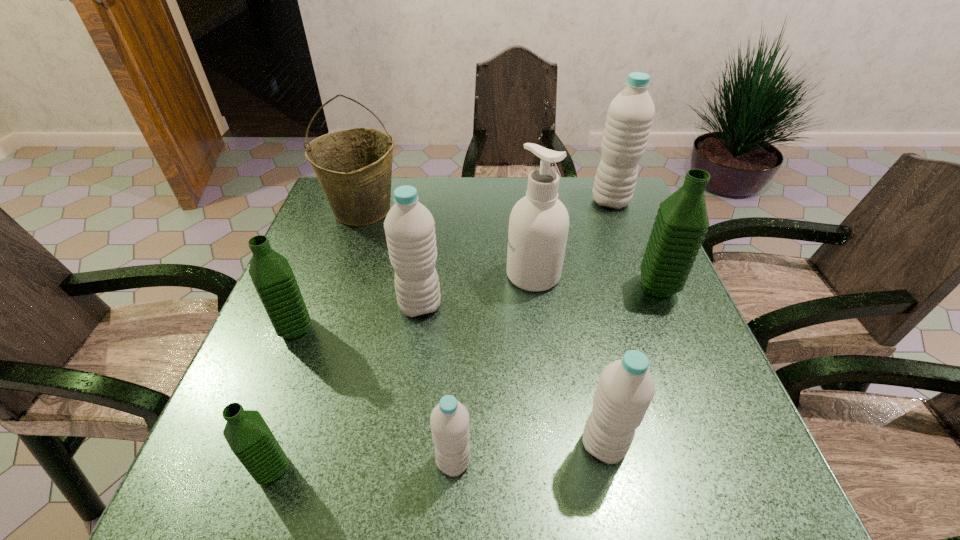
I want to click on object that is at the far right corner, so click(630, 114).

In the image, there is a desktop. Identify the location of vacant space at the far edge. The height and width of the screenshot is (540, 960). (433, 179).

This screenshot has width=960, height=540. I want to click on free space at the left edge, so click(316, 389).

I want to click on free location at the right edge of the desktop, so click(x=625, y=286).

Locate an element on the screen. The height and width of the screenshot is (540, 960). free space at the far left corner of the desktop is located at coordinates (321, 217).

Where is `vacant area at the far right corner of the desktop`? This screenshot has height=540, width=960. vacant area at the far right corner of the desktop is located at coordinates (640, 216).

Where is `unoccupied area between the nearest green water bottle and the biggest green water bottle`? The width and height of the screenshot is (960, 540). unoccupied area between the nearest green water bottle and the biggest green water bottle is located at coordinates (465, 378).

Find the location of `vacant space that's between the nearest green water bottle and the second farthest green water bottle`. vacant space that's between the nearest green water bottle and the second farthest green water bottle is located at coordinates (283, 399).

You are a GUI agent. You are given a task and a screenshot of the screen. Output one action in this format:
    pyautogui.click(x=<x>, y=<y>)
    Task: Click on the vacant space that is in between the cleansing agent and the wine bucket
    The height and width of the screenshot is (540, 960).
    Given the screenshot: What is the action you would take?
    pyautogui.click(x=448, y=243)

Image resolution: width=960 pixels, height=540 pixels. I want to click on vacant space in between the second biggest green water bottle and the farthest water bottle, so click(x=453, y=265).